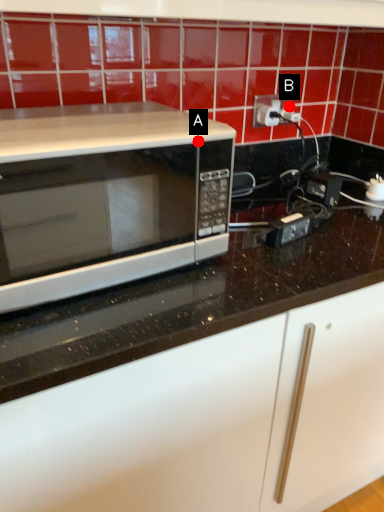
Question: Two points are circled on the image, labeled by A and B beside each circle. Which point is closer to the camera?

Choices:
 (A) A is closer
 (B) B is closer

Answer: (A)